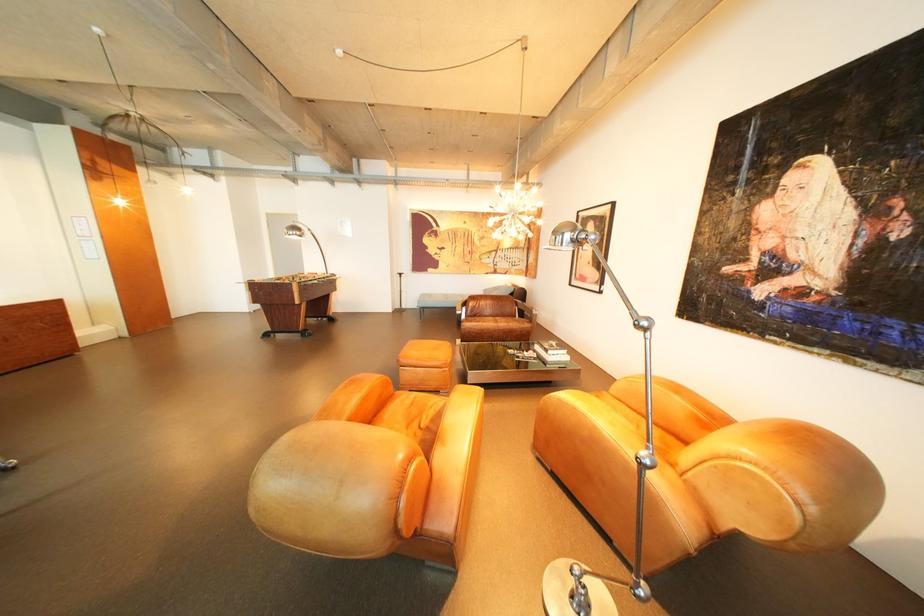
The height and width of the screenshot is (616, 924). Describe the element at coordinates (526, 307) in the screenshot. I see `the brown leather armrest` at that location.